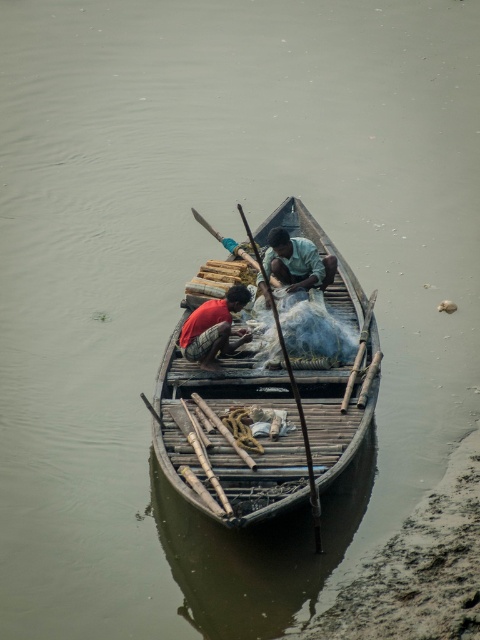
You are standing on the dock and see a boat with two people. The boat has a point at coordinates (225, 326). If you want to throw a rope to the person in the red shirt, who is closer to you, the person in the red shirt or the person in the light blue shirt?

The person in the light blue shirt is closer to you because they are seated, while the person in the red shirt is further away at the point (225, 326).

You are standing on the dock and looking at the boat. Which object is closer to the water surface, the red fabric shirt at center or the wooden paddle at center?

The red fabric shirt at center is closer to the water surface because it is below the wooden paddle at center.